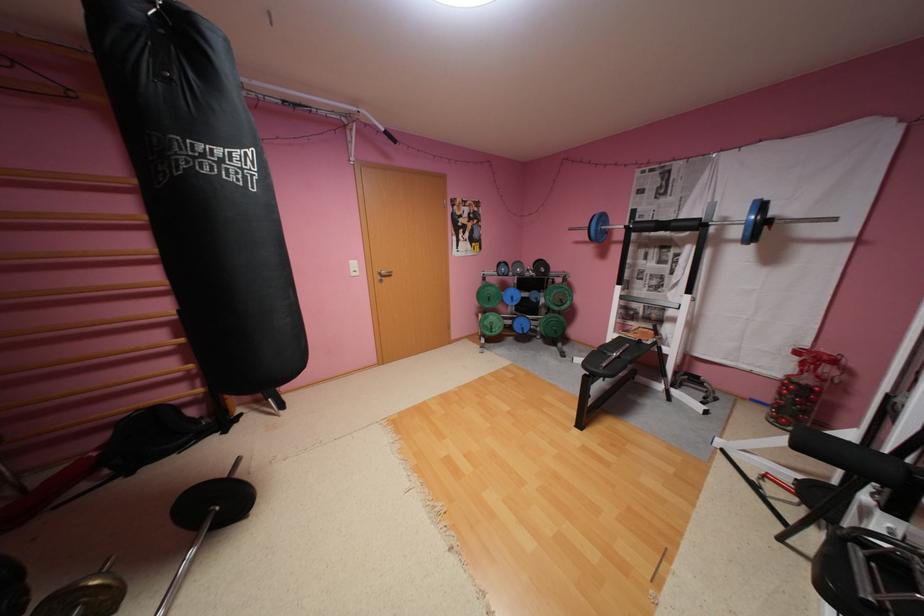
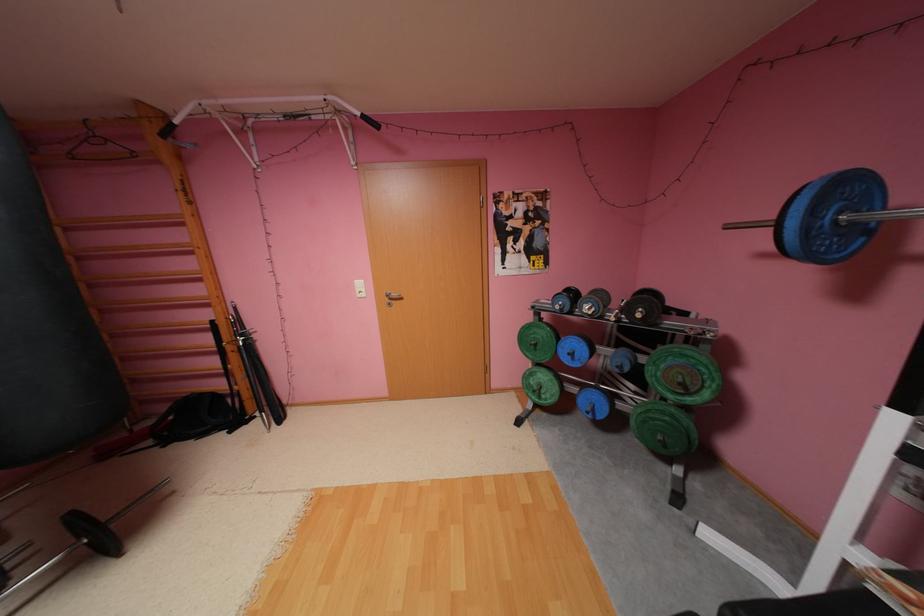
Find the pixel in the second image that matches point (604, 230) in the first image.

(816, 229)